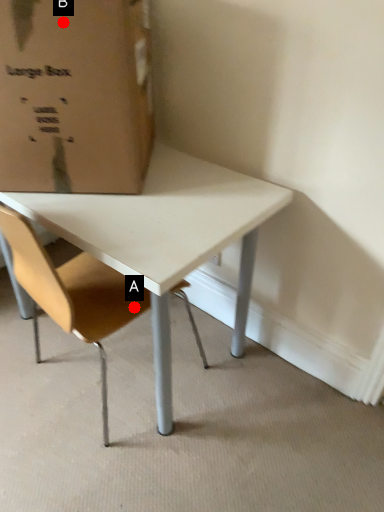
Question: Two points are circled on the image, labeled by A and B beside each circle. Which point is farther to the camera?

Choices:
 (A) A is further
 (B) B is further

Answer: (A)